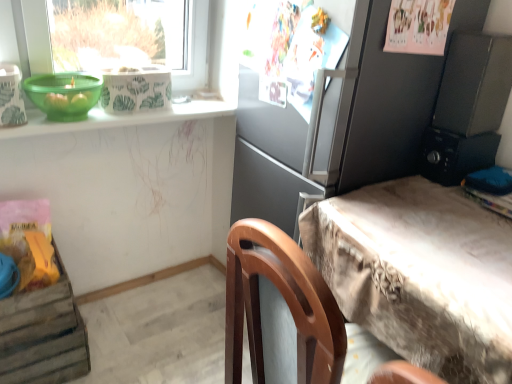
Question: Are green plastic bowl at upper left and black plastic radio at upper right beside each other?

Choices:
 (A) yes
 (B) no

Answer: (B)

Question: Would you say green plastic bowl at upper left contains black plastic radio at upper right?

Choices:
 (A) yes
 (B) no

Answer: (B)

Question: Does green plastic bowl at upper left have a lesser width compared to black plastic radio at upper right?

Choices:
 (A) yes
 (B) no

Answer: (B)

Question: Considering the relative positions of green plastic bowl at upper left and black plastic radio at upper right in the image provided, is green plastic bowl at upper left in front of black plastic radio at upper right?

Choices:
 (A) yes
 (B) no

Answer: (A)

Question: Considering the relative sizes of green plastic bowl at upper left and black plastic radio at upper right in the image provided, is green plastic bowl at upper left taller than black plastic radio at upper right?

Choices:
 (A) no
 (B) yes

Answer: (A)

Question: From the image's perspective, would you say green plastic bowl at upper left is shown under black plastic radio at upper right?

Choices:
 (A) yes
 (B) no

Answer: (B)

Question: Does black plastic radio at upper right lie in front of green plastic bowl at upper left?

Choices:
 (A) no
 (B) yes

Answer: (A)

Question: Are black plastic radio at upper right and green plastic bowl at upper left far apart?

Choices:
 (A) no
 (B) yes

Answer: (B)

Question: From the image's perspective, does black plastic radio at upper right appear lower than green plastic bowl at upper left?

Choices:
 (A) yes
 (B) no

Answer: (A)

Question: Does black plastic radio at upper right have a lesser width compared to green plastic bowl at upper left?

Choices:
 (A) no
 (B) yes

Answer: (B)

Question: From a real-world perspective, is black plastic radio at upper right over green plastic bowl at upper left?

Choices:
 (A) yes
 (B) no

Answer: (B)

Question: Does black plastic radio at upper right appear on the left side of green plastic bowl at upper left?

Choices:
 (A) no
 (B) yes

Answer: (A)

Question: Does wooden crate at lower left come in front of green plastic bowl at upper left?

Choices:
 (A) yes
 (B) no

Answer: (B)